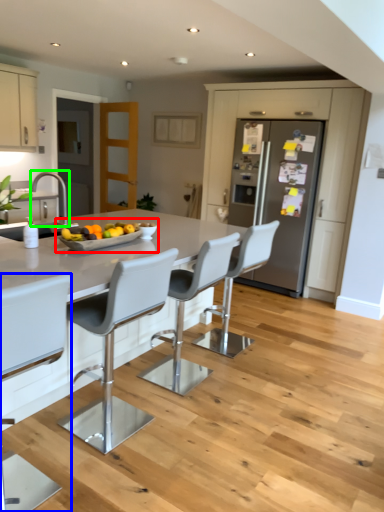
Question: Which object is the closest to the fruit dish (highlighted by a red box)? Choose among these: chair (highlighted by a blue box) or silver (highlighted by a green box).

Choices:
 (A) chair
 (B) silver

Answer: (A)